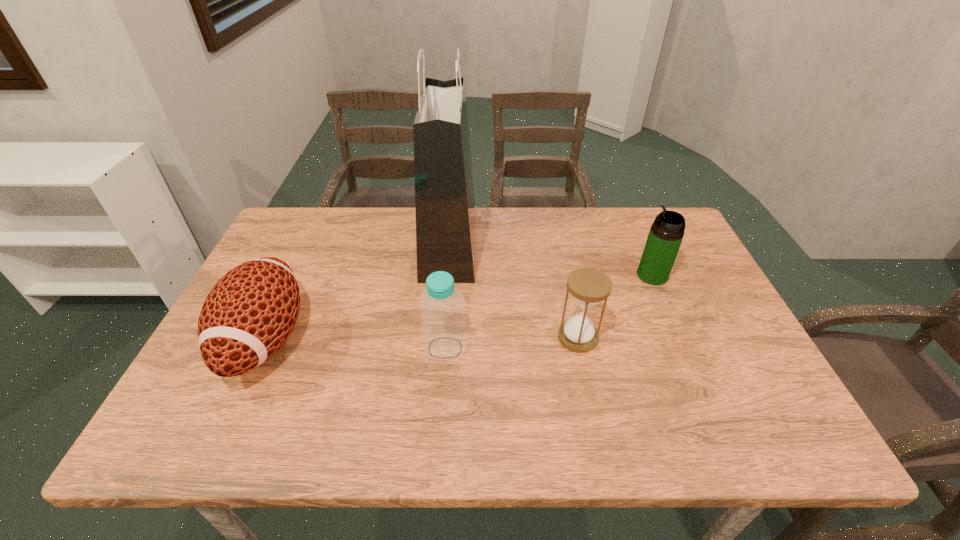
I want to click on free point located 0.270m on the right of the leftmost object, so click(420, 339).

I want to click on vacant point located 0.120m on the right of the hourglass, so click(x=648, y=338).

Where is `object that is positioned at the far edge`? The width and height of the screenshot is (960, 540). object that is positioned at the far edge is located at coordinates (445, 208).

I want to click on object situated at the left edge, so click(248, 315).

I want to click on object that is at the right edge, so click(665, 236).

Where is `vacant space at the far edge`? The width and height of the screenshot is (960, 540). vacant space at the far edge is located at coordinates click(387, 208).

In the image, there is a desktop. In order to click on vacant space at the near edge in this screenshot , I will do `click(324, 436)`.

Identify the location of free space at the right edge of the desktop. (685, 256).

In the image, there is a desktop. What are the coordinates of `vacant space at the far right corner` in the screenshot? It's located at (643, 249).

At what (x,y) coordinates should I click in order to perform the action: click on free area in between the second object from right to left and the bottle. Please return your answer as a coordinate pair (x, y). Image resolution: width=960 pixels, height=540 pixels. Looking at the image, I should click on (512, 342).